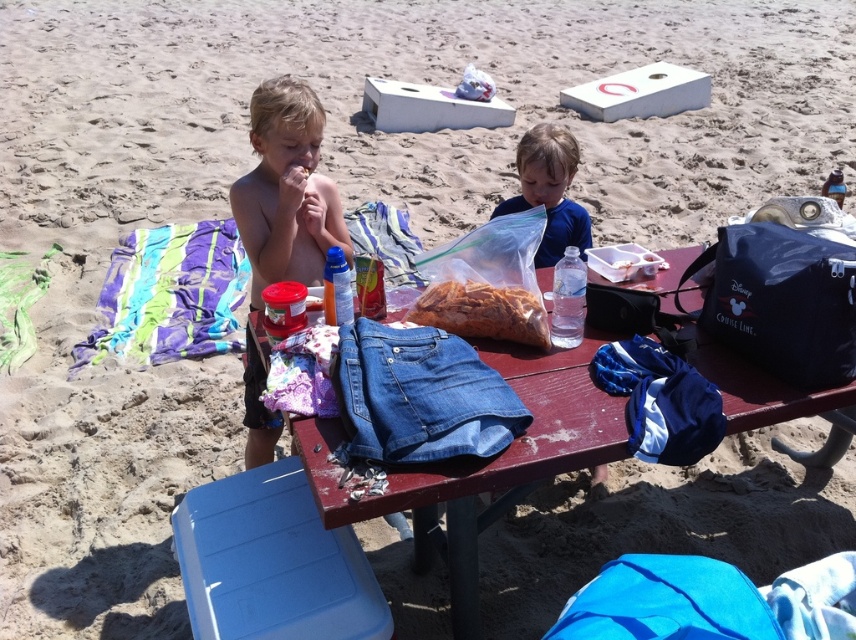
Question: Estimate the real-world distances between objects in this image. Which object is farther from the blonde hair boy at center?

Choices:
 (A) wooden picnic table at center
 (B) translucent plastic bag of nuts at center
 (C) multicolored striped towel at left

Answer: (C)

Question: Is blue matte shirt at center above translucent plastic bag of nuts at center?

Choices:
 (A) no
 (B) yes

Answer: (B)

Question: Does wooden picnic table at center come behind blonde hair boy at center?

Choices:
 (A) no
 (B) yes

Answer: (A)

Question: Considering the real-world distances, which object is farthest from the blue matte shirt at center?

Choices:
 (A) wooden picnic table at center
 (B) multicolored striped towel at left
 (C) translucent plastic bag of nuts at center

Answer: (B)

Question: Observing the image, what is the correct spatial positioning of blonde hair boy at center in reference to blue matte shirt at center?

Choices:
 (A) right
 (B) left

Answer: (B)

Question: Which object is closer to the camera taking this photo?

Choices:
 (A) blue matte shirt at center
 (B) wooden picnic table at center
 (C) translucent plastic bag of nuts at center

Answer: (B)